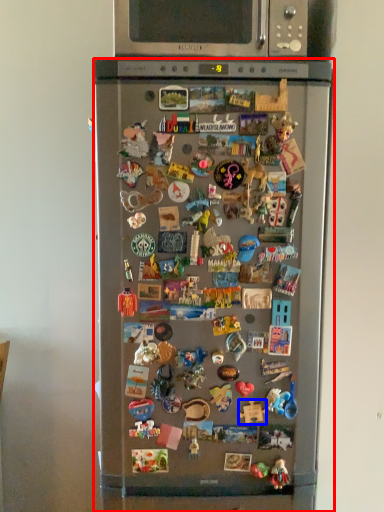
Question: Which point is closer to the camera, refrigerator (highlighted by a red box) or toy (highlighted by a blue box)?

Choices:
 (A) refrigerator
 (B) toy

Answer: (A)